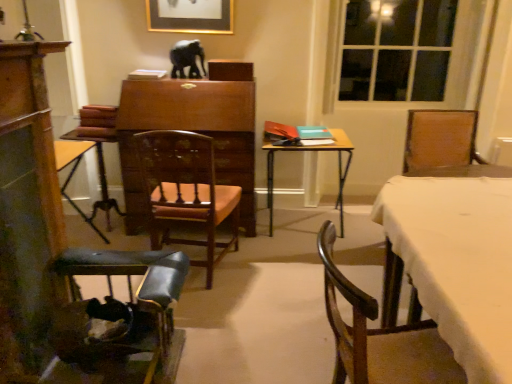
Locate an element on the screen. free space in front of wooden polished chair at center, which is the 2th chair from right to left is located at coordinates (216, 314).